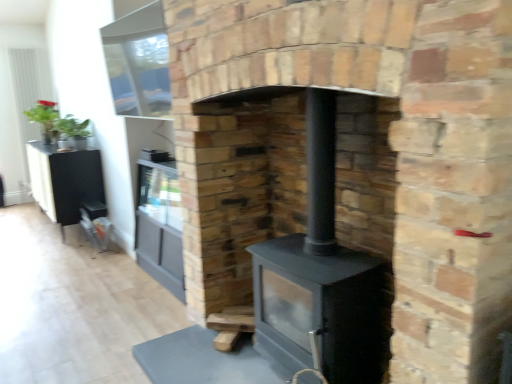
At what (x,y) coordinates should I click in order to perform the action: click on vacant point to the left of black matte wood burning stove at center. Please return your answer as a coordinate pair (x, y). The image size is (512, 384). Looking at the image, I should click on (209, 364).